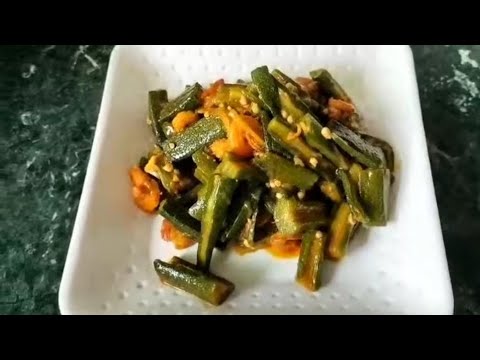
Identify the location of grey table. (28, 220).